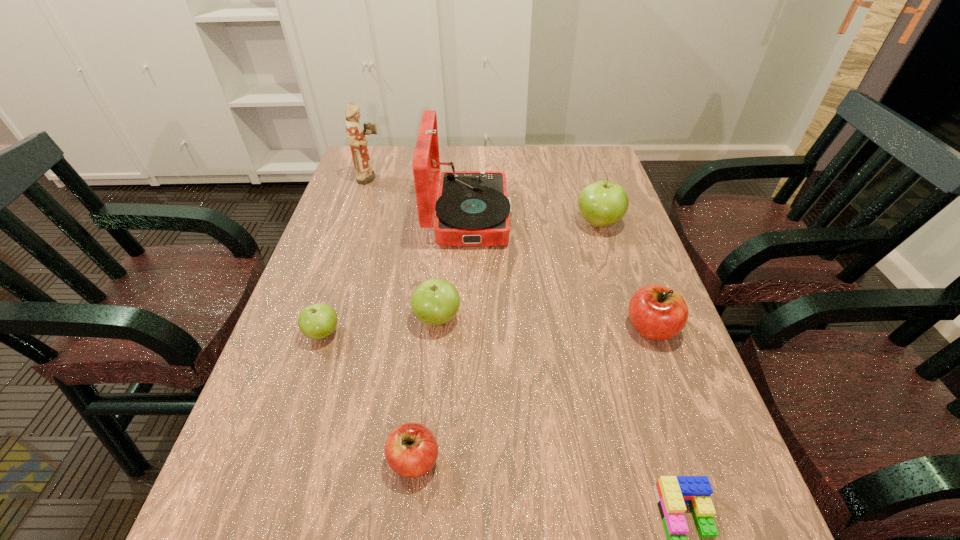
What are the coordinates of `the smaller red apple` in the screenshot? It's located at (411, 450).

At what (x,y) coordinates should I click in order to perform the action: click on free space located 0.060m on the front-facing side of the phonograph_record. Please return your answer as a coordinate pair (x, y). Looking at the image, I should click on (532, 217).

Locate an element on the screen. This screenshot has width=960, height=540. free location located on the front-facing side of the figurine is located at coordinates (486, 179).

Locate an element on the screen. free space located 0.260m on the back of the tallest apple is located at coordinates (580, 164).

Locate an element on the screen. The height and width of the screenshot is (540, 960). vacant space situated on the front of the second biggest green apple is located at coordinates (418, 531).

Find the location of a particular element. The image size is (960, 540). vacant space located 0.390m on the left of the right red apple is located at coordinates (449, 328).

Find the location of `free point located on the right of the leftmost apple`. free point located on the right of the leftmost apple is located at coordinates (396, 333).

Find the location of a particular element. free space located on the left of the smaller red apple is located at coordinates (307, 460).

Locate an element on the screen. Image resolution: width=960 pixels, height=540 pixels. object present at the far edge is located at coordinates (356, 136).

Find the location of `figurine that is at the left edge`. figurine that is at the left edge is located at coordinates (356, 136).